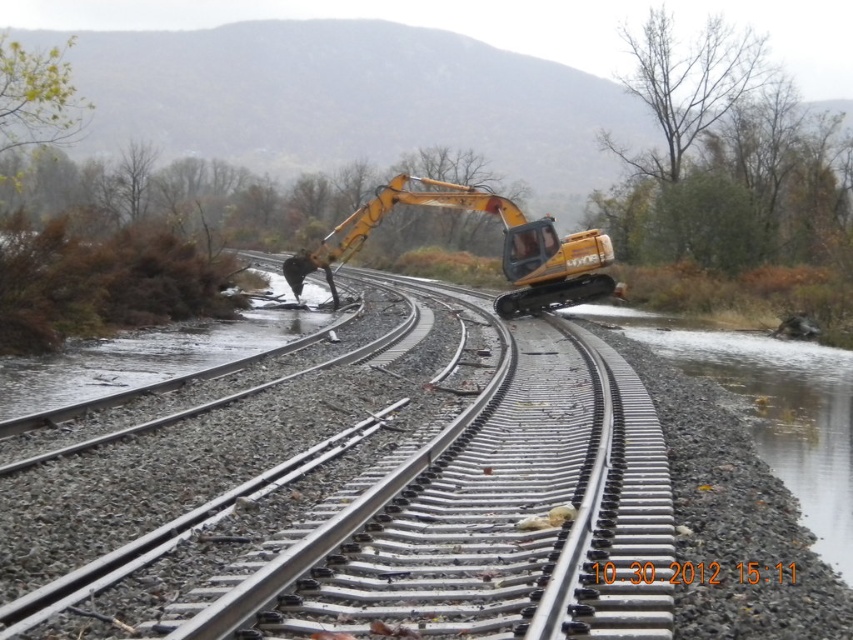
You are a railway inspector checking the scene. You notice the metal train track at center and the clear water at bottom right. Which object appears larger in the image?

The clear water at bottom right is larger than the metal train track at center.

You are a railway inspector checking the tracks. You notice the metal train track at center and the yellow rubber excavator at center. Which object is larger in size?

The yellow rubber excavator at center is larger than the metal train track at center.

You are a railway inspector checking the tracks. You notice the clear water at bottom right and the yellow rubber excavator at center. Which object is closer to you from your current position?

The clear water at bottom right is in front of the yellow rubber excavator at center, so it is closer to you.